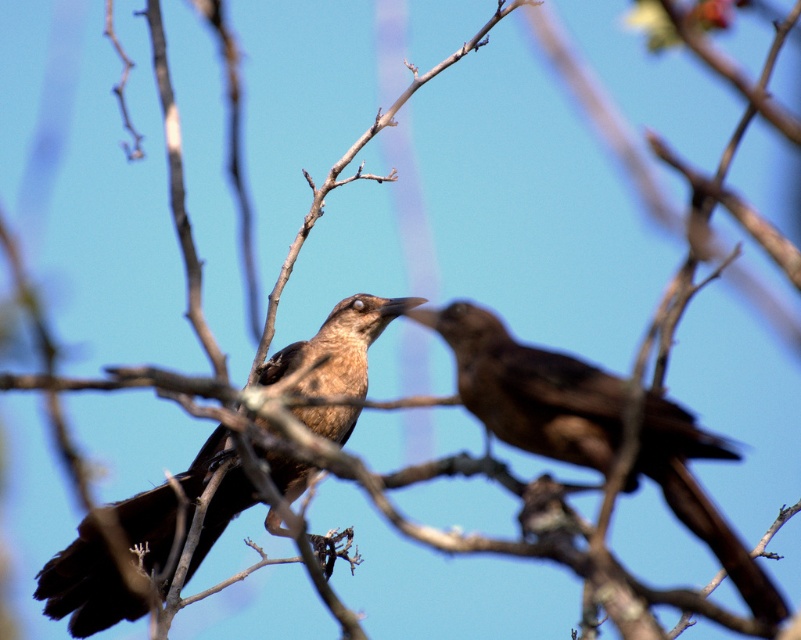
You are a photographer trying to focus on two points in the image. The first point is at coordinates point (590, 390) and the second is at point (284, 376). Which point is closer to your camera lens?

Point (590, 390) is closer to the camera lens than point (284, 376).

You are a birdwatcher observing two brown matte birds in a tree. You notice the brown matte bird at right and the brown matte bird at upper left. Based on their positions, which bird is higher up in the tree?

The brown matte bird at right is higher up in the tree because it is positioned above the brown matte bird at upper left.

You are a wildlife photographer aiming to capture a closeup shot of the brown matte bird at right. Your camera has a focus point at coordinates 0.609, 0.663. Is this focus point correctly positioned to capture the bird?

Yes, the focus point at coordinates (530, 388) aligns with the position of the brown matte bird at right, so it is correctly positioned to capture the bird.